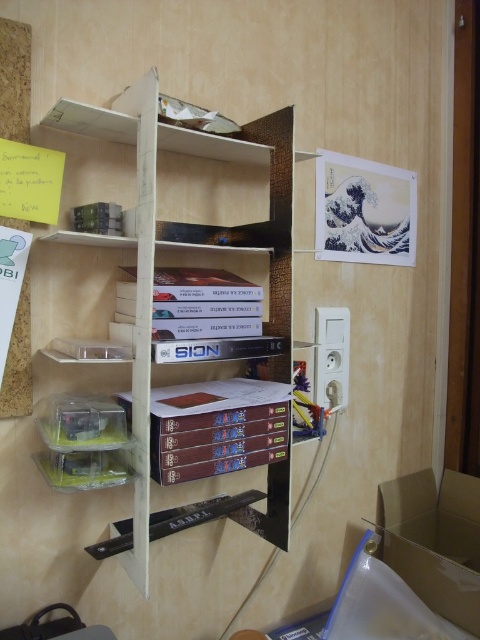
Question: Which object appears closest to the camera in this image?

Choices:
 (A) white matte bookshelf at center
 (B) cardboard box at lower right
 (C) hardcover book at center

Answer: (A)

Question: Does white matte bookshelf at center have a greater width compared to cardboard box at lower right?

Choices:
 (A) no
 (B) yes

Answer: (B)

Question: Does cardboard box at lower right have a smaller size compared to hardcover book at center?

Choices:
 (A) yes
 (B) no

Answer: (B)

Question: Which is nearer to the hardcover book at center?

Choices:
 (A) white matte bookshelf at center
 (B) cardboard box at lower right

Answer: (A)

Question: Does cardboard box at lower right appear on the left side of hardcover book at center?

Choices:
 (A) no
 (B) yes

Answer: (A)

Question: Estimate the real-world distances between objects in this image. Which object is closer to the hardcover book at center?

Choices:
 (A) cardboard box at lower right
 (B) white matte bookshelf at center

Answer: (B)